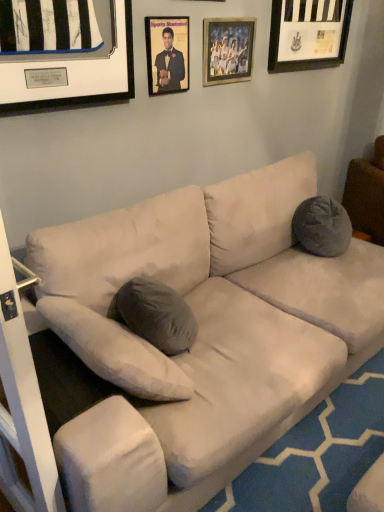
Question: From the image's perspective, is gray fabric pillow at right located above black matte picture frame at upper right, which is the 3th picture frame from left to right?

Choices:
 (A) no
 (B) yes

Answer: (A)

Question: Is gray fabric pillow at right turned away from black matte picture frame at upper right, which is the 3th picture frame from left to right?

Choices:
 (A) yes
 (B) no

Answer: (B)

Question: Is gray fabric pillow at right at the left side of black matte picture frame at upper right, which is the 3th picture frame from left to right?

Choices:
 (A) yes
 (B) no

Answer: (B)

Question: Is gray fabric pillow at right wider than black matte picture frame at upper right, which is the 3th picture frame from left to right?

Choices:
 (A) yes
 (B) no

Answer: (A)

Question: Considering the relative sizes of gray fabric pillow at right and black matte picture frame at upper right, which ranks as the 1th picture frame in right-to-left order, in the image provided, is gray fabric pillow at right taller than black matte picture frame at upper right, which ranks as the 1th picture frame in right-to-left order,?

Choices:
 (A) no
 (B) yes

Answer: (B)

Question: Considering the positions of wooden picture frame at upper center, the second picture frame positioned from the left, and gray fabric pillow at right in the image, is wooden picture frame at upper center, the second picture frame positioned from the left, wider or thinner than gray fabric pillow at right?

Choices:
 (A) thin
 (B) wide

Answer: (A)

Question: From the image's perspective, relative to gray fabric pillow at right, is wooden picture frame at upper center, the second picture frame positioned from the left, above or below?

Choices:
 (A) below
 (B) above

Answer: (B)

Question: In terms of size, does wooden picture frame at upper center, which appears as the second picture frame when viewed from the right, appear bigger or smaller than gray fabric pillow at right?

Choices:
 (A) small
 (B) big

Answer: (A)

Question: Would you say wooden picture frame at upper center, which appears as the second picture frame when viewed from the right, is inside or outside gray fabric pillow at right?

Choices:
 (A) inside
 (B) outside

Answer: (B)

Question: Is point (236, 37) closer or farther from the camera than point (317, 51)?

Choices:
 (A) farther
 (B) closer

Answer: (B)

Question: Is wooden picture frame at upper center, the second picture frame positioned from the left, to the left or to the right of black matte picture frame at upper right, which ranks as the 1th picture frame in right-to-left order, in the image?

Choices:
 (A) right
 (B) left

Answer: (B)

Question: Do you think wooden picture frame at upper center, the second picture frame positioned from the left, is within black matte picture frame at upper right, which ranks as the 1th picture frame in right-to-left order, or outside of it?

Choices:
 (A) outside
 (B) inside

Answer: (A)

Question: From a real-world perspective, is wooden picture frame at upper center, the second picture frame positioned from the left, physically located above or below black matte picture frame at upper right, which is the 3th picture frame from left to right?

Choices:
 (A) below
 (B) above

Answer: (A)

Question: From the image's perspective, is matte black frame at upper center, which is the 3th picture frame in right-to-left order, above or below wooden picture frame at upper center, which appears as the second picture frame when viewed from the right?

Choices:
 (A) above
 (B) below

Answer: (B)

Question: Considering the positions of point (158, 30) and point (238, 25), is point (158, 30) closer or farther from the camera than point (238, 25)?

Choices:
 (A) closer
 (B) farther

Answer: (A)